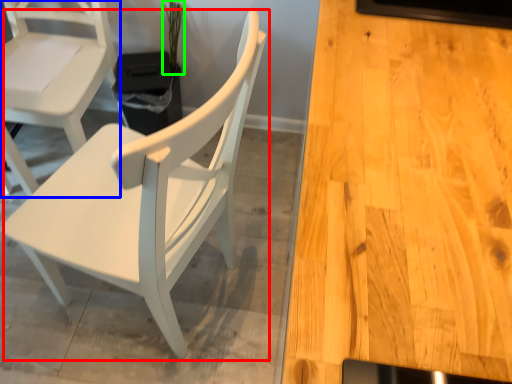
Question: Which object is positioned farthest from chair (highlighted by a red box)? Select from chair (highlighted by a blue box) and plant (highlighted by a green box).

Choices:
 (A) chair
 (B) plant

Answer: (B)